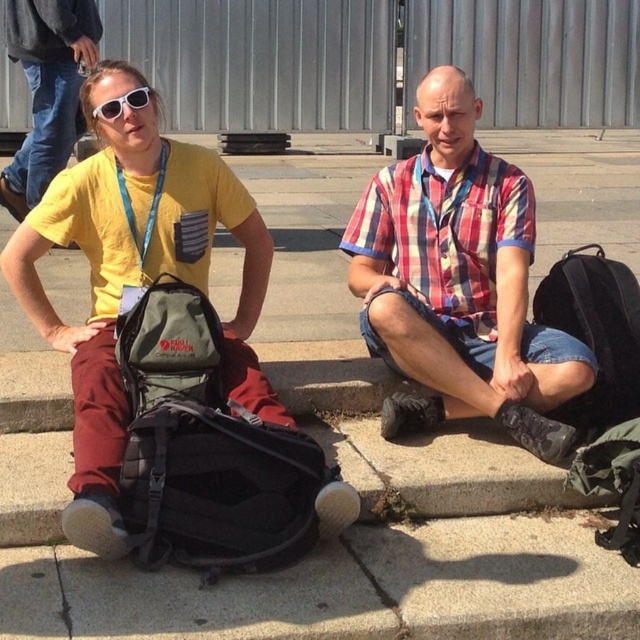
Can you confirm if matte black backpack at center is wider than black fabric backpack at right?

Yes, matte black backpack at center is wider than black fabric backpack at right.

Is matte black backpack at center in front of black fabric backpack at right?

Yes, matte black backpack at center is closer to the viewer.

Describe the element at coordinates (209, 451) in the screenshot. Image resolution: width=640 pixels, height=640 pixels. I see `matte black backpack at center` at that location.

The height and width of the screenshot is (640, 640). I want to click on matte black backpack at center, so click(209, 451).

Measure the distance from black fabric backpack at right to white matte sunglasses at upper left.

black fabric backpack at right and white matte sunglasses at upper left are 2.01 meters apart.

Does point (588, 397) lie behind point (115, 113)?

Yes.

The image size is (640, 640). Describe the element at coordinates (595, 332) in the screenshot. I see `black fabric backpack at right` at that location.

Find the location of a particular element. The height and width of the screenshot is (640, 640). black fabric backpack at right is located at coordinates (595, 332).

Can you confirm if plaid cotton shirt at center is shorter than yellow matte t-shirt at left?

In fact, plaid cotton shirt at center may be taller than yellow matte t-shirt at left.

Which of these two, plaid cotton shirt at center or yellow matte t-shirt at left, stands shorter?

With less height is yellow matte t-shirt at left.

Is point (413, 323) positioned in front of point (92, 22)?

Yes, point (413, 323) is in front of point (92, 22).

Find the location of a particular element. This screenshot has height=640, width=640. plaid cotton shirt at center is located at coordinates (460, 282).